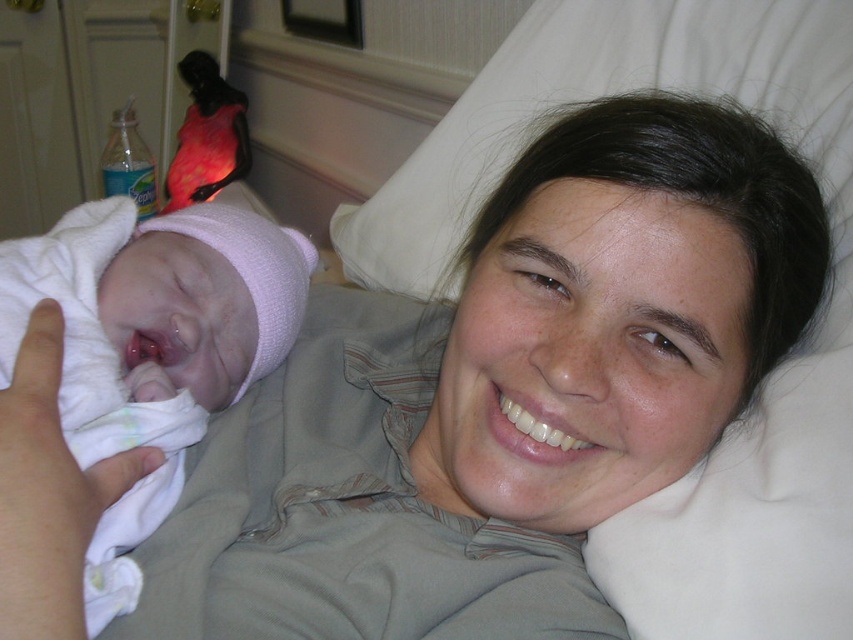
Question: From the image, what is the correct spatial relationship of white soft cloth at left in relation to shiny pink parrot at upper left?

Choices:
 (A) below
 (B) above

Answer: (A)

Question: Which object appears closest to the camera in this image?

Choices:
 (A) shiny pink parrot at upper left
 (B) white soft cloth at left

Answer: (B)

Question: Which point appears farthest from the camera in this image?

Choices:
 (A) (172, 164)
 (B) (132, 330)

Answer: (A)

Question: Does white soft cloth at left appear on the left side of shiny pink parrot at upper left?

Choices:
 (A) yes
 (B) no

Answer: (B)

Question: From the image, what is the correct spatial relationship of white soft cloth at left in relation to shiny pink parrot at upper left?

Choices:
 (A) below
 (B) above

Answer: (A)